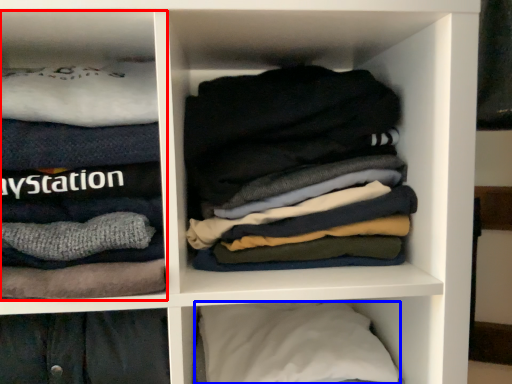
Question: Which object is further to the camera taking this photo, cabinet (highlighted by a red box) or pillow (highlighted by a blue box)?

Choices:
 (A) cabinet
 (B) pillow

Answer: (B)